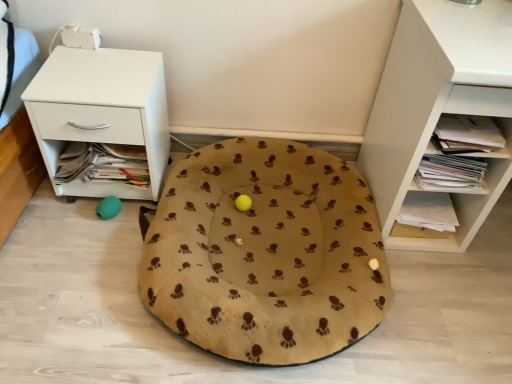
Identify the location of vacant area that lies between white glossy nightstand at left and beige fabric dog bed at center. Image resolution: width=512 pixels, height=384 pixels. 104,266.